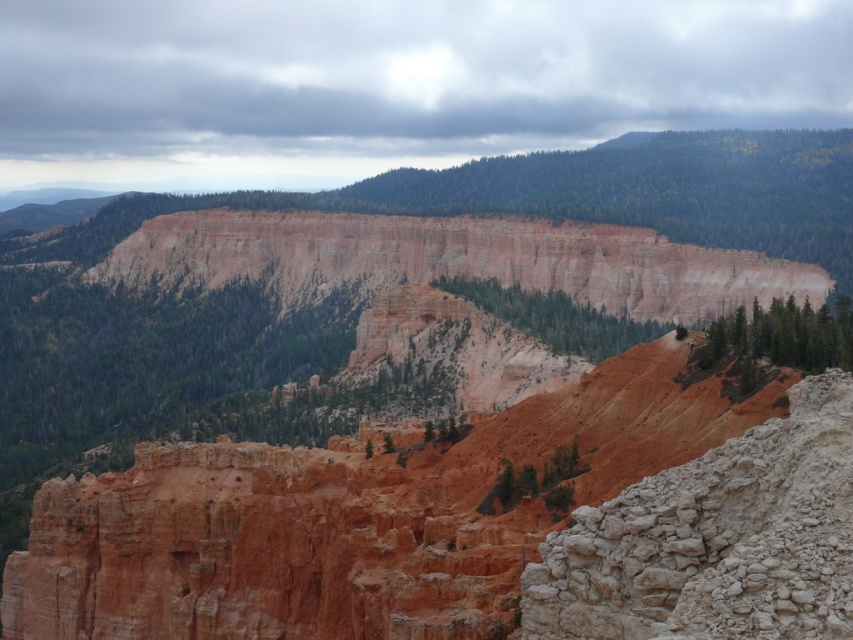
You are hiking in this landscape and want to take a photo of both the white rough rock at center right and the green textured trees at center. Which object should you focus on first to ensure both are in clear view?

You should focus on the white rough rock at center right first because it is closer to you than the green textured trees at center. By focusing on the closer object, the trees will also be in focus due to the depth of field.

You are a hiker planning to take a photo of the white rough rock at center right and the green matte trees at right. Which object should you focus on first if you want both to be in clear focus?

The white rough rock at center right is located below green matte trees at right, so you should focus on the green matte trees at right first to ensure both are in clear focus.